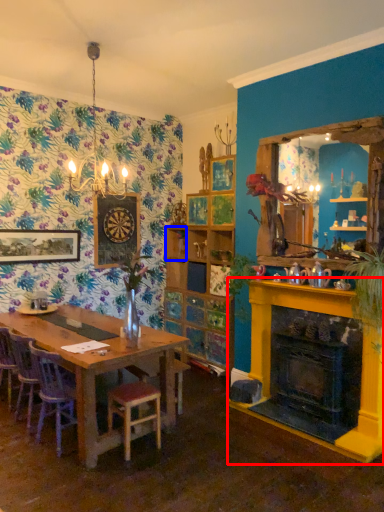
Question: Among these objects, which one is nearest to the camera, fireplace (highlighted by a red box) or shelf (highlighted by a blue box)?

Choices:
 (A) fireplace
 (B) shelf

Answer: (A)